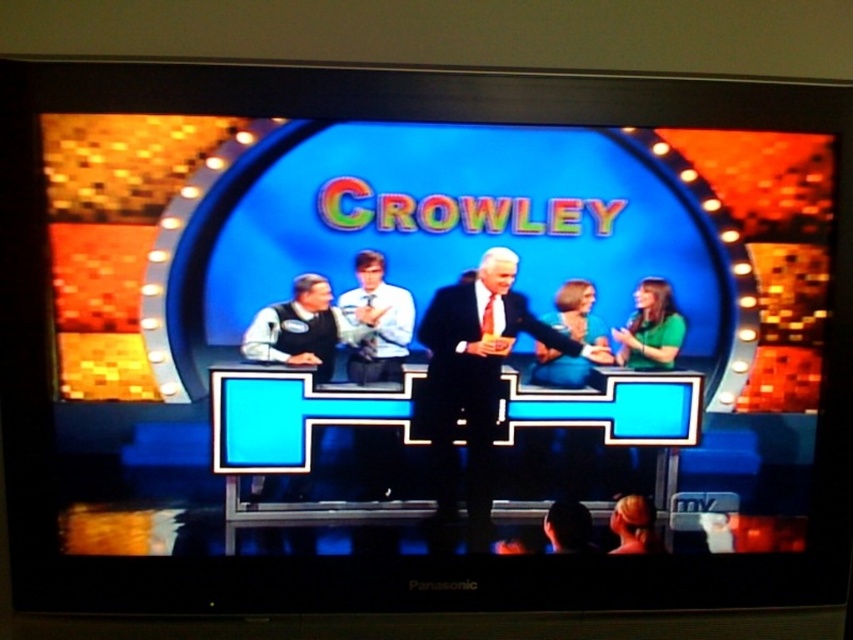
Question: Can you confirm if green fabric dress at center is positioned to the left of black hair at lower center?

Choices:
 (A) no
 (B) yes

Answer: (A)

Question: Is green fabric dress at center behind black hair at lower center?

Choices:
 (A) yes
 (B) no

Answer: (B)

Question: Considering the real-world distances, which object is farthest from the green matte shirt at right?

Choices:
 (A) green fabric dress at center
 (B) black hair at lower center
 (C) blonde hair at center

Answer: (B)

Question: Which object is the farthest from the black suit at center?

Choices:
 (A) green matte shirt at right
 (B) black hair at lower center
 (C) green fabric dress at center
 (D) blonde hair at center

Answer: (D)

Question: Considering the real-world distances, which object is closest to the green fabric dress at center?

Choices:
 (A) black hair at lower center
 (B) blonde hair at center

Answer: (A)

Question: Can you confirm if black suit at center is positioned above blonde hair at center?

Choices:
 (A) yes
 (B) no

Answer: (A)